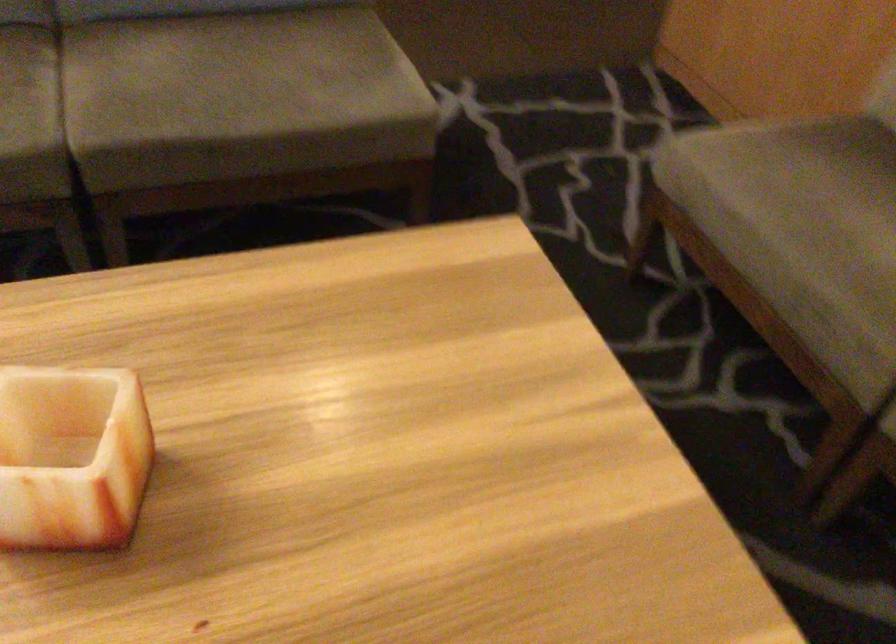
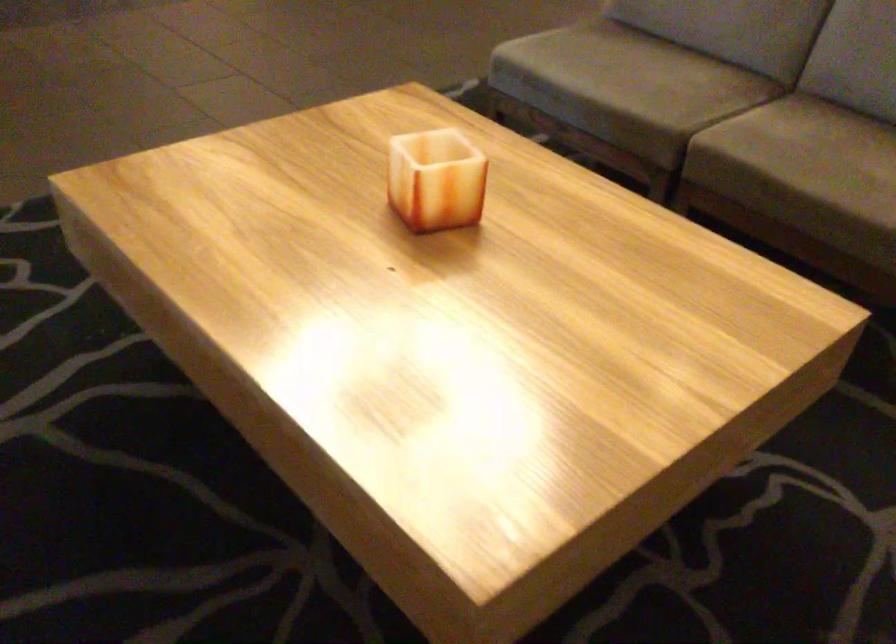
Question: The first image is from the beginning of the video and the second image is from the end. How did the camera likely rotate when shooting the video?

Choices:
 (A) Left
 (B) Right
 (C) Up
 (D) Down

Answer: (A)